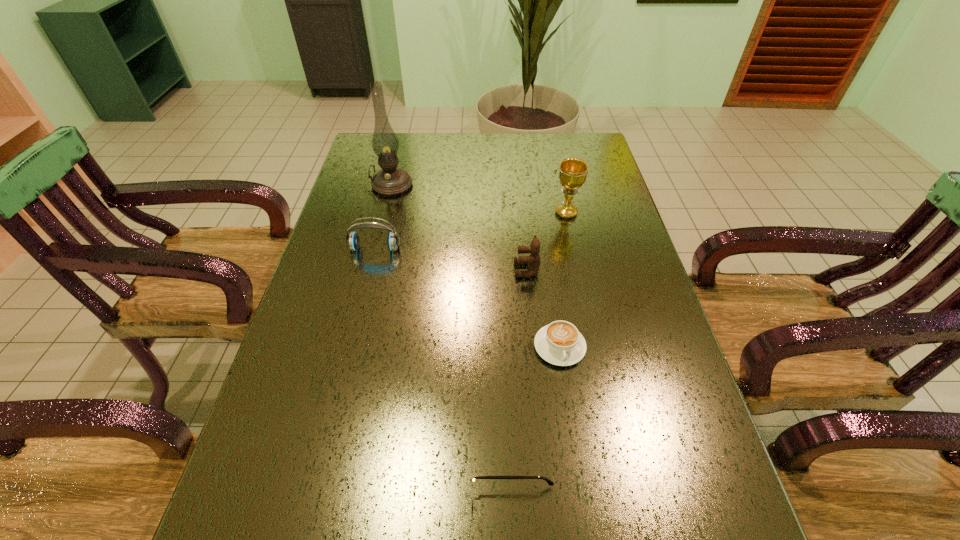
Where is `free space located 0.370m on the face of the teddy bear`? free space located 0.370m on the face of the teddy bear is located at coordinates (373, 270).

What are the coordinates of `free space located 0.070m on the face of the teddy bear` in the screenshot? It's located at (488, 270).

Identify the location of blank space located 0.280m on the ear cups of the fourth nearest object. (353, 339).

Where is `free space located 0.280m on the side of the cappuccino with the handle`? Image resolution: width=960 pixels, height=540 pixels. free space located 0.280m on the side of the cappuccino with the handle is located at coordinates (585, 509).

Image resolution: width=960 pixels, height=540 pixels. Identify the location of oil lamp that is positioned at the left edge. (390, 181).

This screenshot has width=960, height=540. I want to click on headset that is at the left edge, so click(x=353, y=241).

Identify the location of object that is at the right edge. The width and height of the screenshot is (960, 540). (572, 171).

At what (x,y) coordinates should I click in order to perform the action: click on vacant area at the far edge. Please return your answer as a coordinate pair (x, y). Looking at the image, I should click on (516, 145).

This screenshot has width=960, height=540. I want to click on vacant space at the left edge of the desktop, so click(x=300, y=461).

Identify the location of vacant space at the right edge of the desktop. (648, 463).